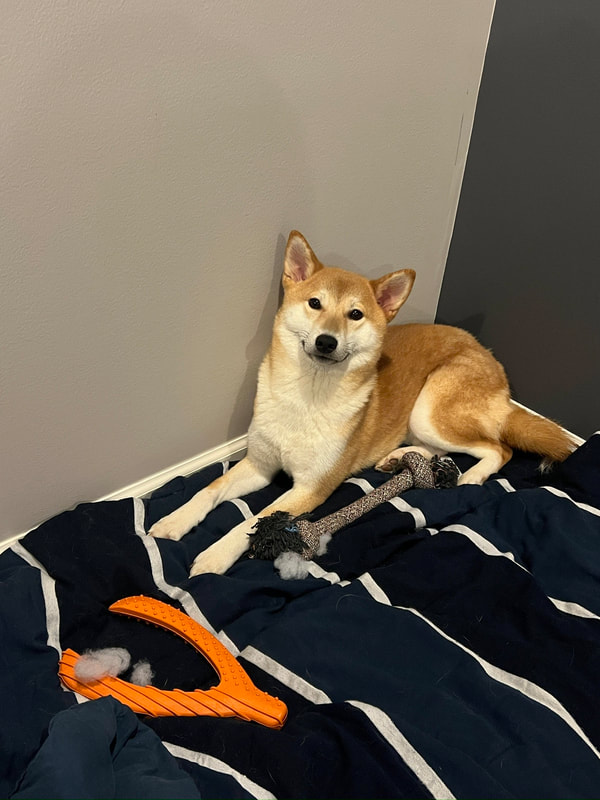
The width and height of the screenshot is (600, 800). I want to click on black blanket with white stripes, so click(376, 673).